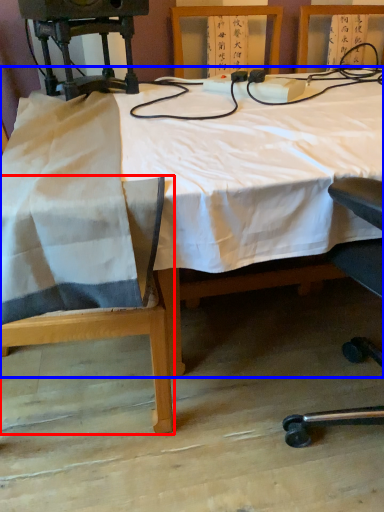
Question: Which object is further to the camera taking this photo, chair (highlighted by a red box) or table (highlighted by a blue box)?

Choices:
 (A) chair
 (B) table

Answer: (A)